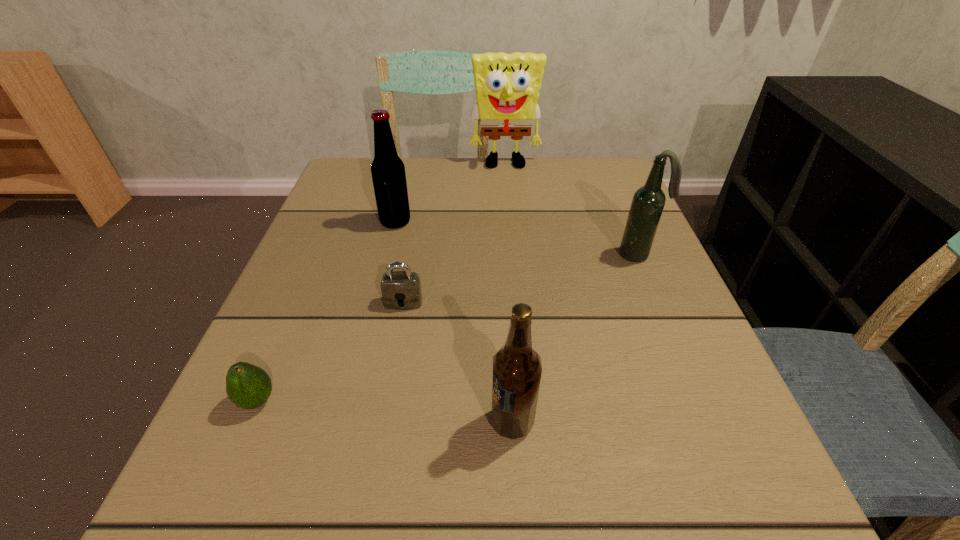
Identify the location of vacant region at the far edge of the desktop. This screenshot has width=960, height=540. (462, 162).

Image resolution: width=960 pixels, height=540 pixels. Identify the location of blank space at the near edge. (575, 529).

This screenshot has width=960, height=540. I want to click on blank space at the left edge of the desktop, so click(316, 239).

What are the coordinates of `blank area at the right edge` in the screenshot? It's located at (642, 286).

At what (x,y) coordinates should I click in order to perform the action: click on free space at the far left corner. Please return your answer as a coordinate pair (x, y). Looking at the image, I should click on (369, 194).

Identify the location of vacant space at the near right corner of the desktop. (770, 523).

Find the location of a particular element. The width and height of the screenshot is (960, 540). vacant space that is in between the fourth nearest object and the sponge is located at coordinates (572, 210).

Identify the location of empty space between the third nearest object and the avocado. The width and height of the screenshot is (960, 540). (330, 352).

You are a GUI agent. You are given a task and a screenshot of the screen. Output one action in this format:
    pyautogui.click(x=<x>, y=<y>)
    Task: Click on the empty location between the third farthest object and the padlock
    Image resolution: width=960 pixels, height=540 pixels.
    Given the screenshot: What is the action you would take?
    pyautogui.click(x=521, y=278)

Locate an element on the screen. vacant space that's between the leftmost object and the second nearest beer bottle is located at coordinates (448, 328).